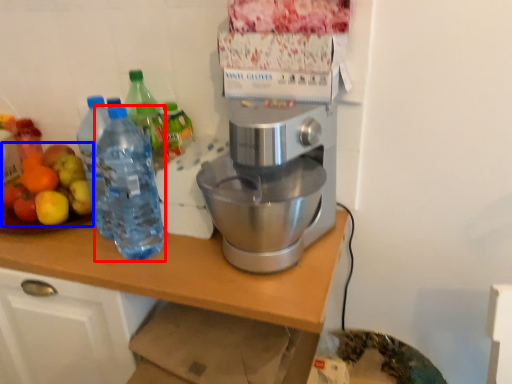
Question: Among these objects, which one is farthest to the camera, bottle (highlighted by a red box) or fruit salad (highlighted by a blue box)?

Choices:
 (A) bottle
 (B) fruit salad

Answer: (B)